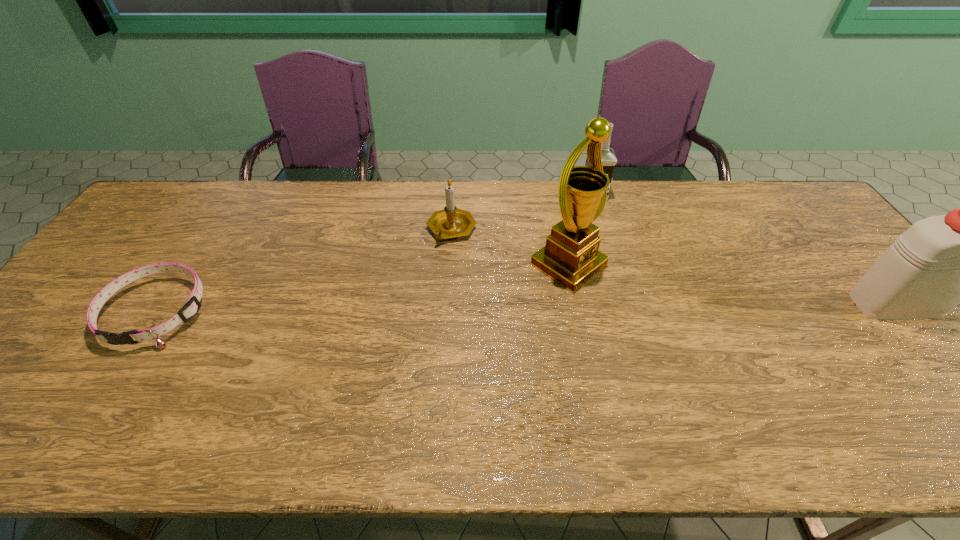
Identify the location of the closest object relative to the tallest object. (450, 222).

This screenshot has height=540, width=960. I want to click on blank space that satisfies the following two spatial constraints: 1. on the front side of the detergent; 2. on the handle side of the fourth tallest object, so click(x=446, y=305).

Where is `free space that satisfies the following two spatial constraints: 1. on the back side of the farthest object; 2. on the left side of the tallest object`? free space that satisfies the following two spatial constraints: 1. on the back side of the farthest object; 2. on the left side of the tallest object is located at coordinates pos(555,195).